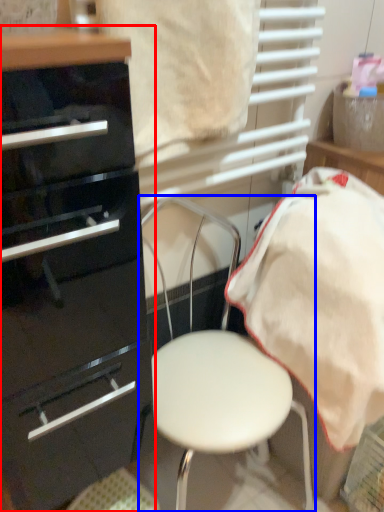
Question: Which point is further to the camera, chest of drawers (highlighted by a red box) or chair (highlighted by a blue box)?

Choices:
 (A) chest of drawers
 (B) chair

Answer: (B)